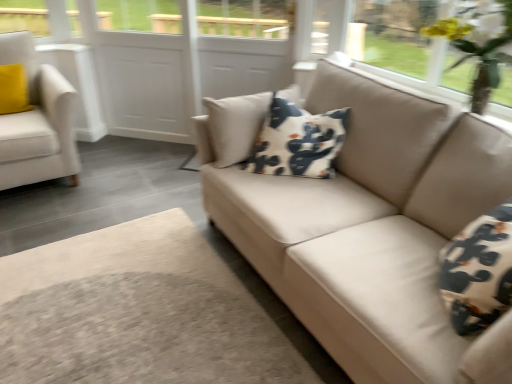
Locate an element on the screen. vacant area that lies in front of white matte screen door at center is located at coordinates (146, 154).